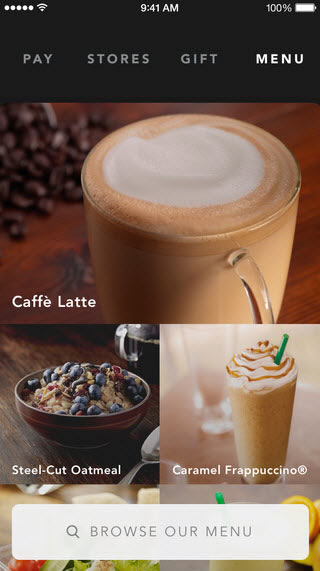
The height and width of the screenshot is (571, 320). Identify the location of clear glass mug handle. (119, 345), (264, 299).